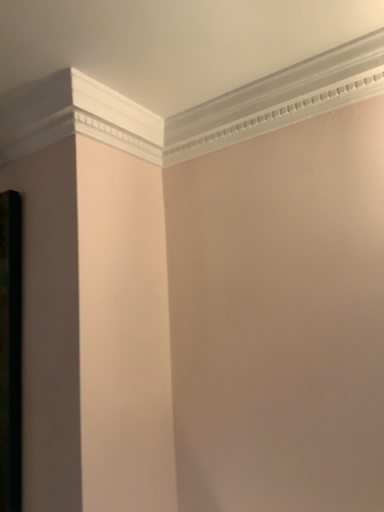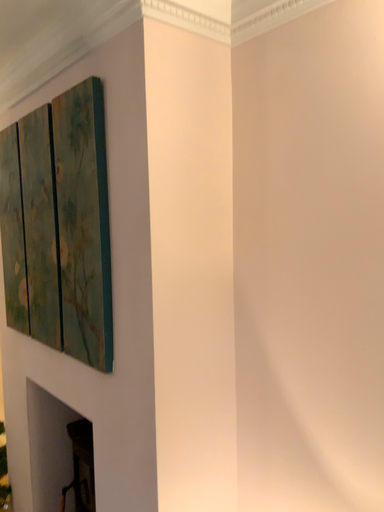
Question: How did the camera likely rotate when shooting the video?

Choices:
 (A) rotated upward
 (B) rotated downward

Answer: (B)